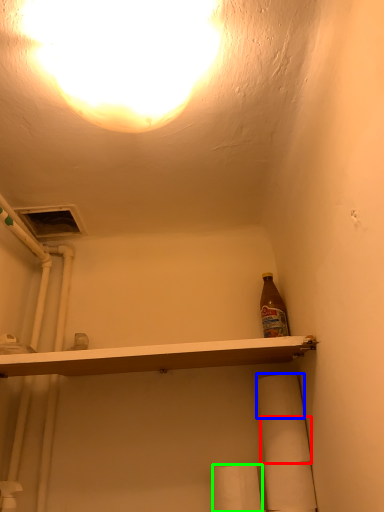
Question: Estimate the real-world distances between objects in this image. Which object is closer to toilet paper (highlighted by a red box), toilet paper (highlighted by a blue box) or toilet paper (highlighted by a green box)?

Choices:
 (A) toilet paper
 (B) toilet paper

Answer: (A)